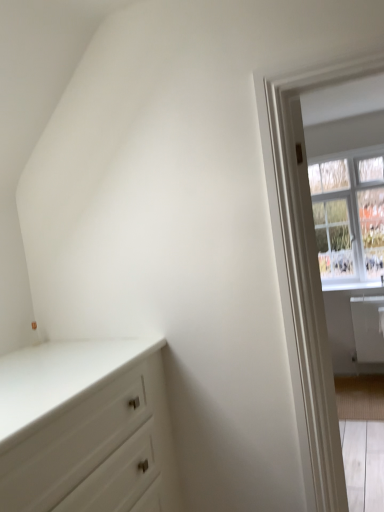
The width and height of the screenshot is (384, 512). Identify the location of free space above white glossy window sill at right (from a real-world perspective). (345, 281).